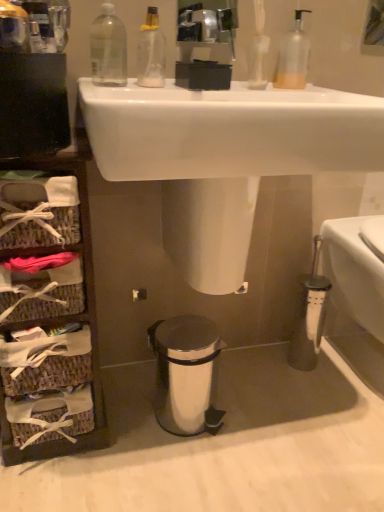
This screenshot has width=384, height=512. Describe the element at coordinates (224, 157) in the screenshot. I see `white glossy sink at upper center` at that location.

Image resolution: width=384 pixels, height=512 pixels. In order to click on metallic mirror at upper center in this screenshot , I will do `click(207, 29)`.

The height and width of the screenshot is (512, 384). Identify the location of white glossy toilet bowl at right. pos(356,268).

What is the approximate width of translucent plastic soap dispenser at upper center, which ranks as the second cleaning product in left-to-right order?

translucent plastic soap dispenser at upper center, which ranks as the second cleaning product in left-to-right order, is 8.13 centimeters wide.

Measure the distance between point (110, 69) and camera.

The distance of point (110, 69) from camera is 36.69 inches.

Identify the location of transparent plastic bottle at upper center, arranged as the 2th cleaning product when viewed from the right. (151, 52).

In order to click on bottle lying below the metallic mirror at upper center (from the image's perspective) in this screenshot , I will do `click(108, 49)`.

Who is taller, clear plastic bottle at upper left or metallic mirror at upper center?

Standing taller between the two is clear plastic bottle at upper left.

From a real-world perspective, is clear plastic bottle at upper left over metallic mirror at upper center?

No, from a real-world perspective, clear plastic bottle at upper left is not over metallic mirror at upper center

Is point (111, 41) behind point (237, 23)?

No, it is not.

Between metallic mirror at upper center and white glossy sink at upper center, which one has smaller size?

Smaller between the two is metallic mirror at upper center.

Is metallic mirror at upper center located outside white glossy sink at upper center?

Yes.

In the image, is metallic mirror at upper center positioned in front of or behind white glossy sink at upper center?

Clearly, metallic mirror at upper center is behind white glossy sink at upper center.

Considering the relative positions of metallic mirror at upper center and white glossy sink at upper center in the image provided, is metallic mirror at upper center to the right of white glossy sink at upper center from the viewer's perspective?

In fact, metallic mirror at upper center is to the left of white glossy sink at upper center.

From a real-world perspective, is woven brown basket at left beneath transparent plastic bottle at upper center, arranged as the 2th cleaning product when viewed from the right?

Yes, from a real-world perspective, woven brown basket at left is below transparent plastic bottle at upper center, arranged as the 2th cleaning product when viewed from the right.

Considering the relative sizes of woven brown basket at left and transparent plastic bottle at upper center, arranged as the 2th cleaning product when viewed from the right, in the image provided, is woven brown basket at left wider than transparent plastic bottle at upper center, arranged as the 2th cleaning product when viewed from the right,?

Indeed, woven brown basket at left has a greater width compared to transparent plastic bottle at upper center, arranged as the 2th cleaning product when viewed from the right.

How different are the orientations of clear plastic bottle at upper left and white glossy sink at upper center in degrees?

0.00153 degrees.

Consider the image. From a real-world perspective, between clear plastic bottle at upper left and white glossy sink at upper center, who is vertically higher?

clear plastic bottle at upper left.

Does clear plastic bottle at upper left have a lesser width compared to white glossy sink at upper center?

Indeed, clear plastic bottle at upper left has a lesser width compared to white glossy sink at upper center.

Is clear plastic bottle at upper left directly adjacent to white glossy sink at upper center?

No, clear plastic bottle at upper left is not with white glossy sink at upper center.

Which of these two, transparent plastic bottle at upper center, the first cleaning product positioned from the left, or silver metallic trash can at lower center, is wider?

silver metallic trash can at lower center is wider.

Considering the sizes of objects transparent plastic bottle at upper center, the first cleaning product positioned from the left, and silver metallic trash can at lower center in the image provided, who is shorter, transparent plastic bottle at upper center, the first cleaning product positioned from the left, or silver metallic trash can at lower center?

Standing shorter between the two is transparent plastic bottle at upper center, the first cleaning product positioned from the left.

In the image, there is a transparent plastic bottle at upper center, the first cleaning product positioned from the left. Where is `bidet below it (from the image's perspective)`? This screenshot has width=384, height=512. bidet below it (from the image's perspective) is located at coordinates (186, 374).

Can you confirm if white glossy toilet bowl at right is positioned to the left of transparent plastic bottle at upper center, arranged as the 2th cleaning product when viewed from the right?

In fact, white glossy toilet bowl at right is to the right of transparent plastic bottle at upper center, arranged as the 2th cleaning product when viewed from the right.

Is white glossy toilet bowl at right bigger than transparent plastic bottle at upper center, the first cleaning product positioned from the left?

Indeed, white glossy toilet bowl at right has a larger size compared to transparent plastic bottle at upper center, the first cleaning product positioned from the left.

Are white glossy toilet bowl at right and transparent plastic bottle at upper center, arranged as the 2th cleaning product when viewed from the right, located far from each other?

white glossy toilet bowl at right is near transparent plastic bottle at upper center, arranged as the 2th cleaning product when viewed from the right, not far away.

I want to click on cleaning product that is the 1st object located above the white glossy toilet bowl at right (from the image's perspective), so click(151, 52).

Considering the positions of points (10, 160) and (230, 227), is point (10, 160) closer to camera compared to point (230, 227)?

Yes, it is.

Find the location of `sink above the woven brown basket at left (from the image's perspective)`. sink above the woven brown basket at left (from the image's perspective) is located at coordinates (224, 157).

Can we say woven brown basket at left lies outside white glossy sink at upper center?

woven brown basket at left is positioned outside white glossy sink at upper center.

From a real-world perspective, who is located higher, woven brown basket at left or white glossy sink at upper center?

From a 3D spatial view, white glossy sink at upper center is above.

Image resolution: width=384 pixels, height=512 pixels. In order to click on mirror in front of the clear plastic bottle at upper left in this screenshot , I will do 207,29.

You are a GUI agent. You are given a task and a screenshot of the screen. Output one action in this format:
    pyautogui.click(x=<x>, y=<y>)
    Task: Click on the sink below the metallic mirror at upper center (from the image's perspective)
    Image resolution: width=384 pixels, height=512 pixels.
    Given the screenshot: What is the action you would take?
    224,157

When comparing their distances from clear plastic bottle at upper left, does silver metallic trash can at lower center or metallic mirror at upper center seem closer?

metallic mirror at upper center is closer to clear plastic bottle at upper left.

Based on their spatial positions, is silver metallic trash can at lower center or woven brown basket at left closer to transparent plastic bottle at upper center, arranged as the 2th cleaning product when viewed from the right?

Among the two, woven brown basket at left is located nearer to transparent plastic bottle at upper center, arranged as the 2th cleaning product when viewed from the right.

Looking at the image, which one is located closer to woven brown basket at left, white glossy sink at upper center or transparent plastic bottle at upper center, arranged as the 2th cleaning product when viewed from the right?

white glossy sink at upper center is positioned closer to the anchor woven brown basket at left.

Based on their spatial positions, is metallic mirror at upper center or woven brown basket at left closer to silver metallic trash can at lower center?

Based on the image, woven brown basket at left appears to be nearer to silver metallic trash can at lower center.

Looking at the image, which one is located further to metallic mirror at upper center, translucent plastic soap dispenser at upper center, acting as the first cleaning product starting from the right, or woven brown basket at left?

Among the two, woven brown basket at left is located further to metallic mirror at upper center.

Based on their spatial positions, is white glossy toilet bowl at right or transparent plastic bottle at upper center, the first cleaning product positioned from the left, further from metallic mirror at upper center?

white glossy toilet bowl at right lies further to metallic mirror at upper center than the other object.

Looking at the image, which one is located closer to translucent plastic soap dispenser at upper center, which ranks as the second cleaning product in left-to-right order, woven brown basket at left or silver metallic trash can at lower center?

woven brown basket at left is closer to translucent plastic soap dispenser at upper center, which ranks as the second cleaning product in left-to-right order.

Based on their spatial positions, is metallic mirror at upper center or clear plastic bottle at upper left closer to silver metallic trash can at lower center?

Based on the image, clear plastic bottle at upper left appears to be nearer to silver metallic trash can at lower center.

Find the location of a particular element. This screenshot has width=384, height=512. sink between clear plastic bottle at upper left and translucent plastic soap dispenser at upper center, acting as the first cleaning product starting from the right, from left to right is located at coordinates (224, 157).

You are a GUI agent. You are given a task and a screenshot of the screen. Output one action in this format:
    pyautogui.click(x=<x>, y=<y>)
    Task: Click on the mirror between transparent plastic bottle at upper center, arranged as the 2th cleaning product when viewed from the right, and white glossy toilet bowl at right from left to right
    
    Given the screenshot: What is the action you would take?
    pyautogui.click(x=207, y=29)

Locate an element on the screen. The image size is (384, 512). cleaning product situated between clear plastic bottle at upper left and translucent plastic soap dispenser at upper center, acting as the first cleaning product starting from the right, from left to right is located at coordinates (151, 52).

At what (x,y) coordinates should I click in order to perform the action: click on mirror between transparent plastic bottle at upper center, the first cleaning product positioned from the left, and translucent plastic soap dispenser at upper center, which ranks as the second cleaning product in left-to-right order, from left to right. Please return your answer as a coordinate pair (x, y). The width and height of the screenshot is (384, 512). Looking at the image, I should click on (207, 29).